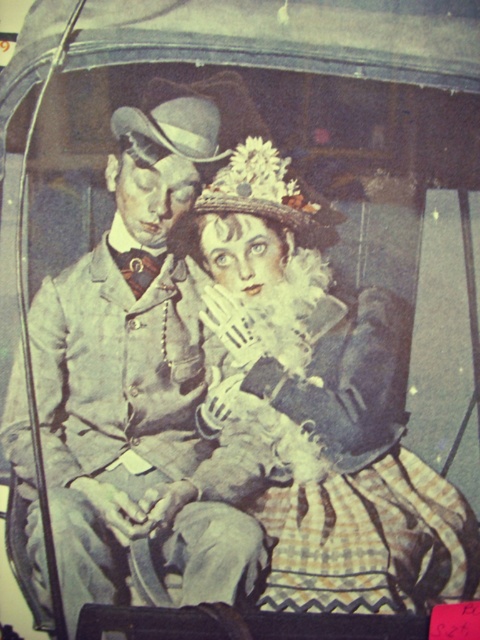
In the vintage photograph, there are two individuals seated in a horse drawn carriage. The person on the left is wearing a light colored suit jacket, white shirt, dark bow tie, and top hat. The other person is wearing a matte black dress. There is a point labeled as point (314, 408). Based on the scene, where is this point located?

The point (314, 408) is located on the matte black dress at center.

You are a photographer in the early 20th century preparing to take a portrait of two people sitting in a horse drawn carriage. You have a limited amount of space in the carriage. You see the matte black dress at center and the matte gray suit at center. Which clothing item takes up more horizontal space?

The matte black dress at center takes up more horizontal space because its width is larger than the matte gray suit at center.

You are standing in front of this vintage photograph and want to touch the closest item to you between the matte black dress at center and the matte gray suit at center. Which one should you reach for?

The matte black dress at center is closer to you than the matte gray suit at center, so you should reach for the matte black dress at center.